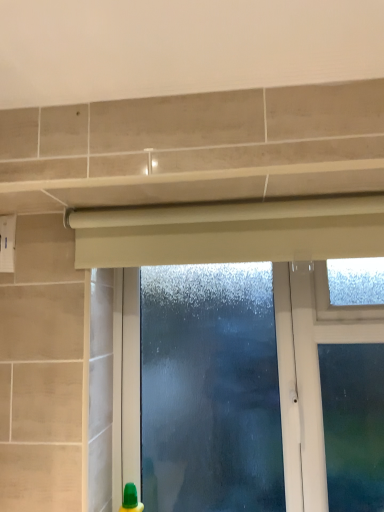
The image size is (384, 512). I want to click on free point above beige matte curtain at upper center (from a real-world perspective), so click(x=228, y=203).